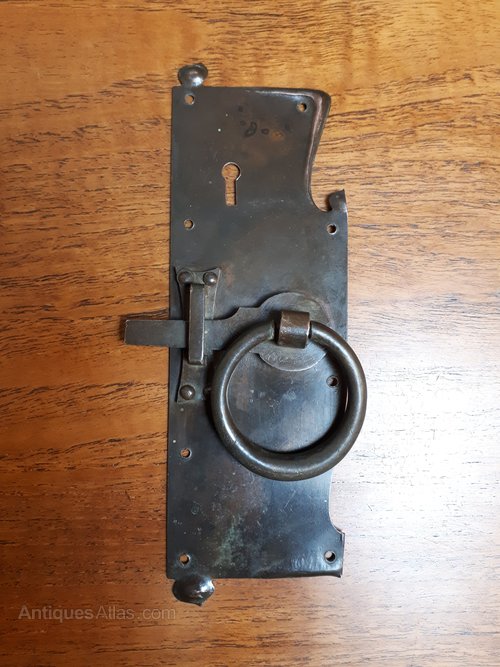
Find the location of a particular element. This screenshot has width=500, height=667. metal latch is located at coordinates (155, 331).